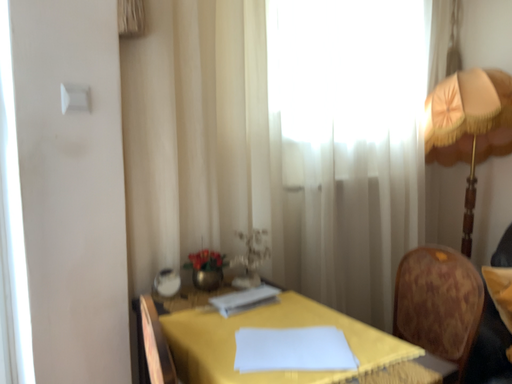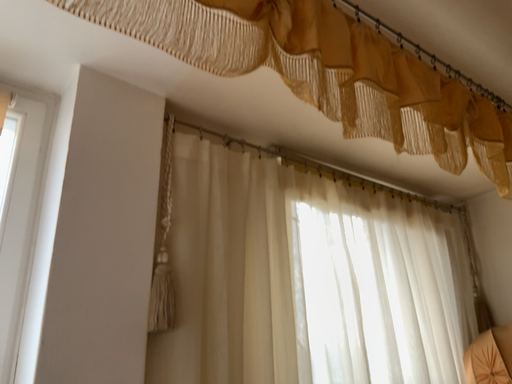
Question: Which way did the camera rotate in the video?

Choices:
 (A) rotated downward
 (B) rotated upward

Answer: (B)